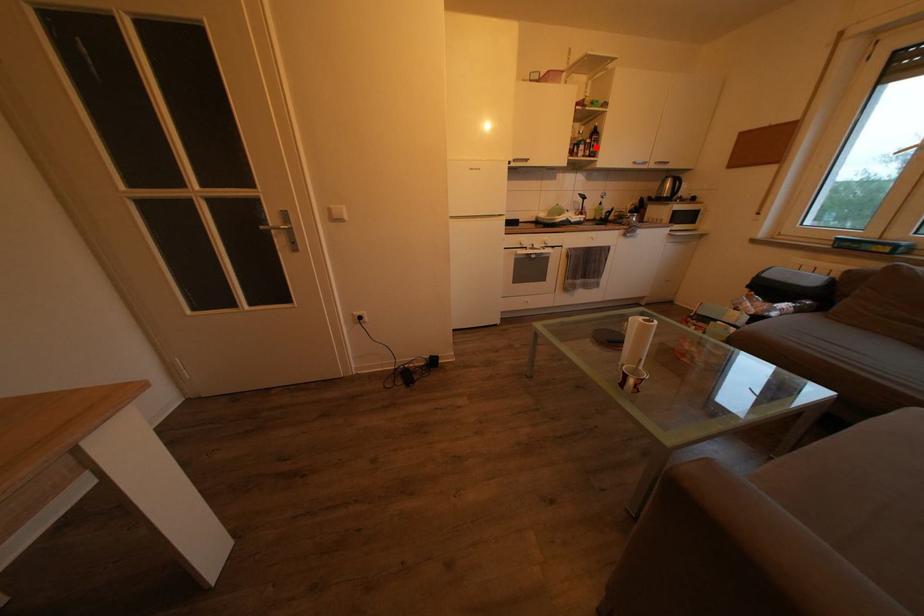
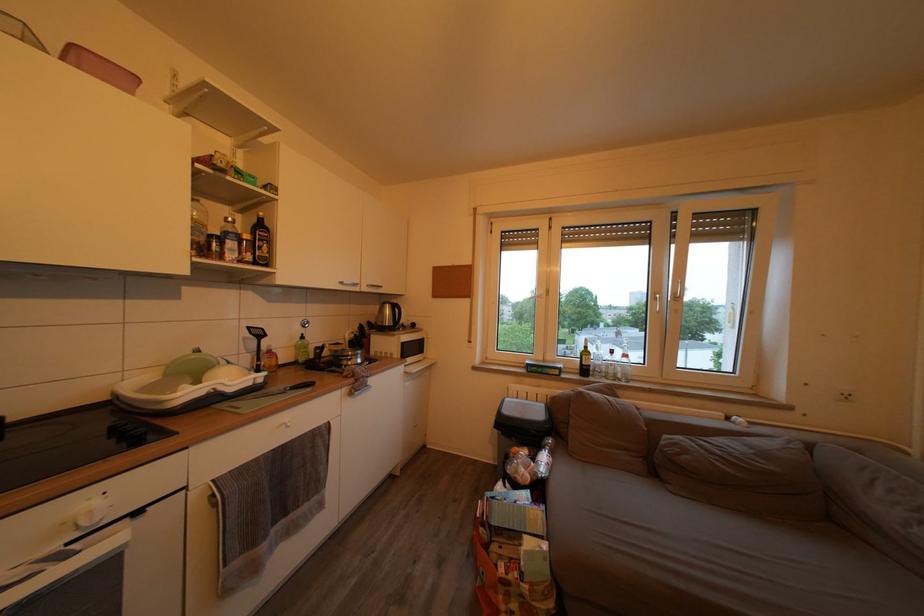
Question: I am providing you with two images of the same scene from different viewpoints. Given a red point in image1, look at the same physical point in image2. Is it:

Choices:
 (A) Closer to the viewpoint
 (B) Farther from the viewpoint

Answer: (B)